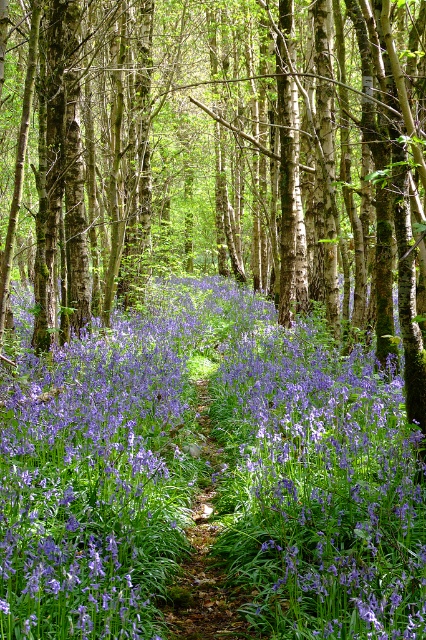
Is purple flowerbed at center to the left of green leafy trail at center from the viewer's perspective?

Correct, you'll find purple flowerbed at center to the left of green leafy trail at center.

Does purple flowerbed at center have a lesser height compared to green leafy trail at center?

Incorrect, purple flowerbed at center's height does not fall short of green leafy trail at center's.

Who is more distant from viewer, (331, 24) or (196, 634)?

The point (331, 24) is behind.

Image resolution: width=426 pixels, height=640 pixels. I want to click on purple flowerbed at center, so click(x=218, y=157).

Between point (14, 579) and point (249, 632), which one is positioned in front?

Point (14, 579)

Measure the distance between point (302, 509) and camera.

Point (302, 509) is 3.70 meters away from camera.

The width and height of the screenshot is (426, 640). What do you see at coordinates (222, 477) in the screenshot? I see `purple matte flower at center` at bounding box center [222, 477].

The image size is (426, 640). I want to click on purple matte flower at center, so click(222, 477).

Between point (118, 257) and point (224, 369), which one is positioned behind?

The point (118, 257) is more distant.

This screenshot has height=640, width=426. What are the coordinates of `purple flowerbed at center` in the screenshot? It's located at (218, 157).

Who is more distant from viewer, (310, 252) or (69, 497)?

The point (310, 252) is more distant.

This screenshot has height=640, width=426. What are the coordinates of `purple flowerbed at center` in the screenshot? It's located at (218, 157).